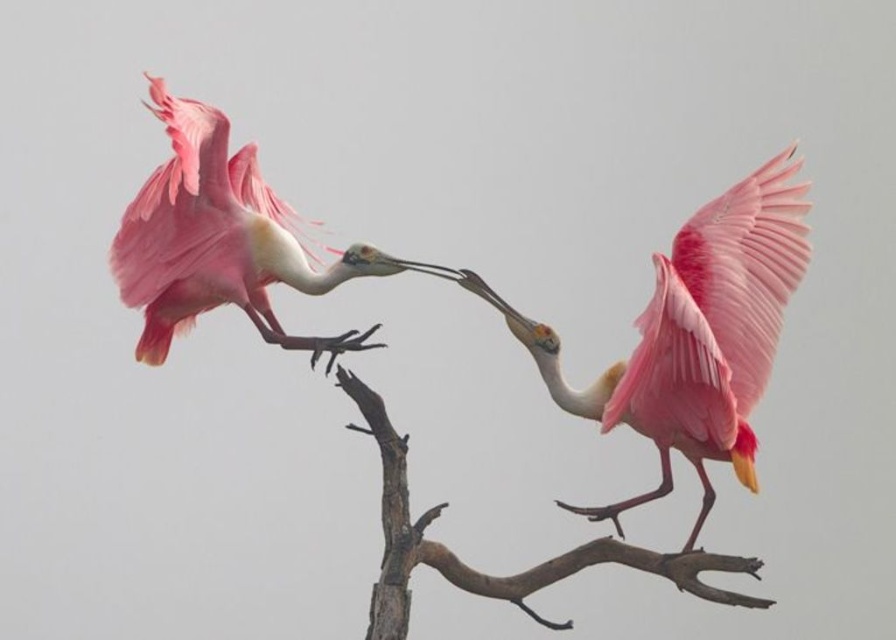
Question: Can you confirm if pink feathered spoonbill at center is positioned above matte pink spoonbill at upper left?

Choices:
 (A) no
 (B) yes

Answer: (A)

Question: Does matte pink spoonbill at upper left have a larger size compared to brown rough tree branch at center?

Choices:
 (A) yes
 (B) no

Answer: (A)

Question: Which object is closer to the camera taking this photo?

Choices:
 (A) brown rough tree branch at center
 (B) pink feathered spoonbill at center

Answer: (B)

Question: Which of the following is the farthest from the observer?

Choices:
 (A) brown rough tree branch at center
 (B) matte pink spoonbill at upper left
 (C) pink feathered spoonbill at center

Answer: (A)

Question: Can you confirm if matte pink spoonbill at upper left is positioned to the right of brown rough tree branch at center?

Choices:
 (A) yes
 (B) no

Answer: (B)

Question: Considering the real-world distances, which object is closest to the matte pink spoonbill at upper left?

Choices:
 (A) pink feathered spoonbill at center
 (B) brown rough tree branch at center

Answer: (B)